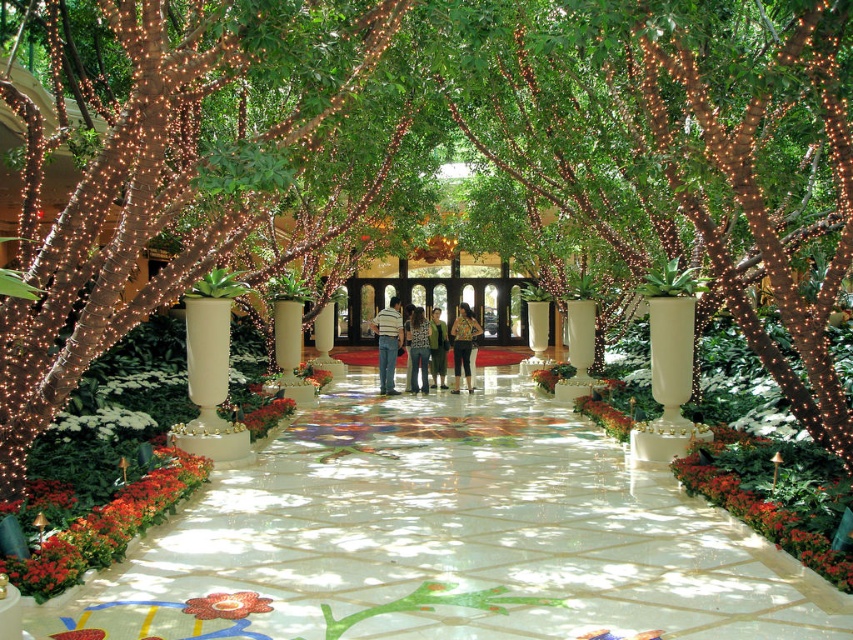
You are designing a layout for a small indoor garden and need to place both the green leafy plant at lower right and the red velvet flower at center. Given that your space is limited, which object should you prioritize placing first to ensure both fit?

Since the green leafy plant at lower right occupies less space than the red velvet flower at center, you should prioritize placing the red velvet flower at center first to ensure there is enough space for it, then place the smaller green leafy plant at lower right.

You are a guest at the hotel and want to take a photo of both the red glossy flower at lower left and the red velvet flower at center. Which flower should you move closer to in order to capture both in the same frame?

You should move closer to the red glossy flower at lower left because it is closer to the viewer than the red velvet flower at center, allowing both to be in the same frame when positioned appropriately.

You are standing on the marble pathway in the luxurious indoor garden. You see a striped cotton shirt at center and a green leafy plant at lower right. Which object is positioned to the right of the other?

The green leafy plant at lower right is positioned to the right of the striped cotton shirt at center.